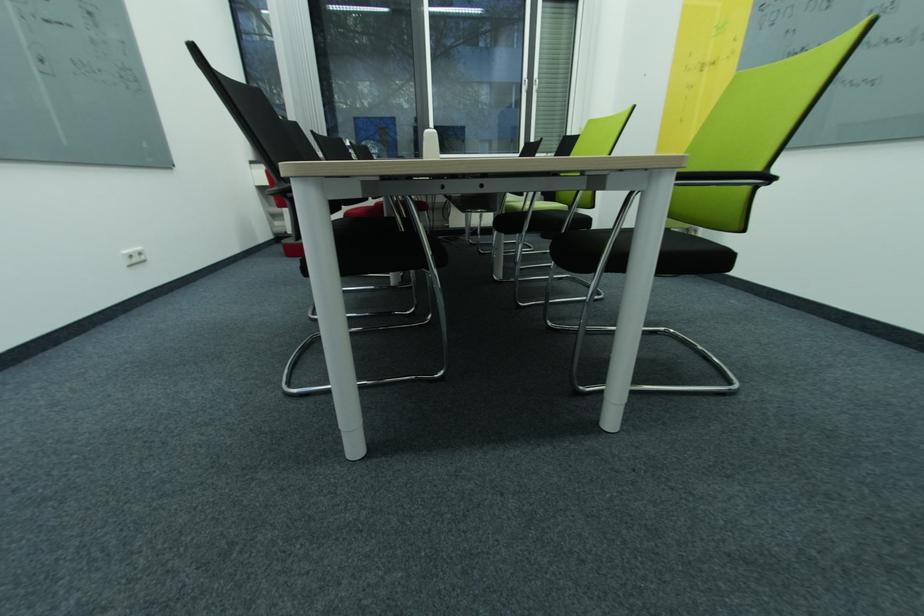
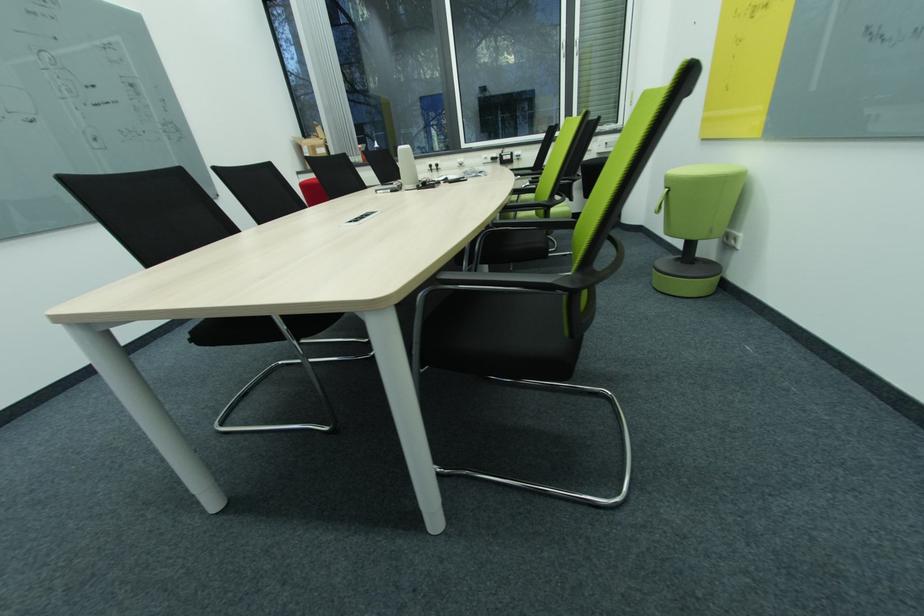
Question: What movement of the cameraman would produce the second image?

Choices:
 (A) Left
 (B) Right
 (C) Forward
 (D) Backward

Answer: (B)